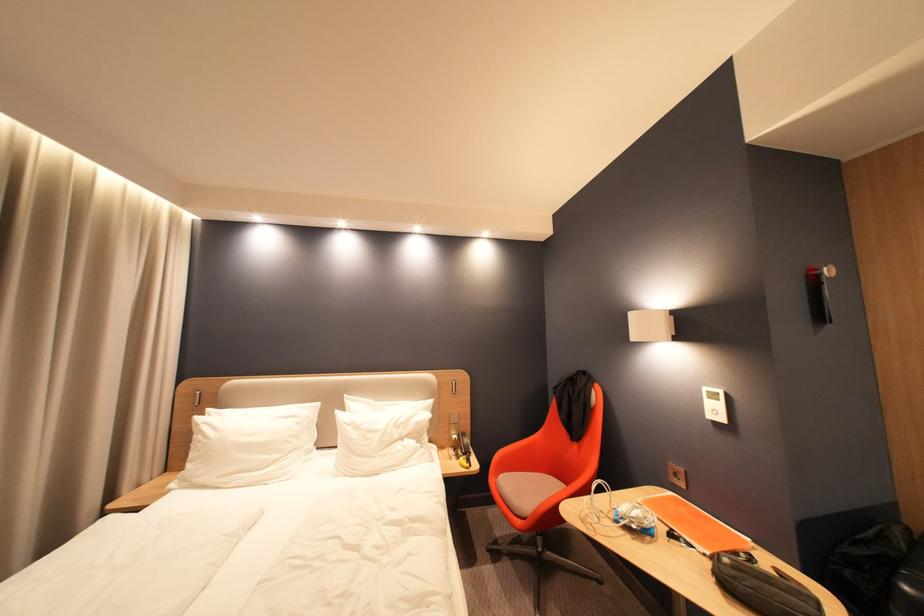
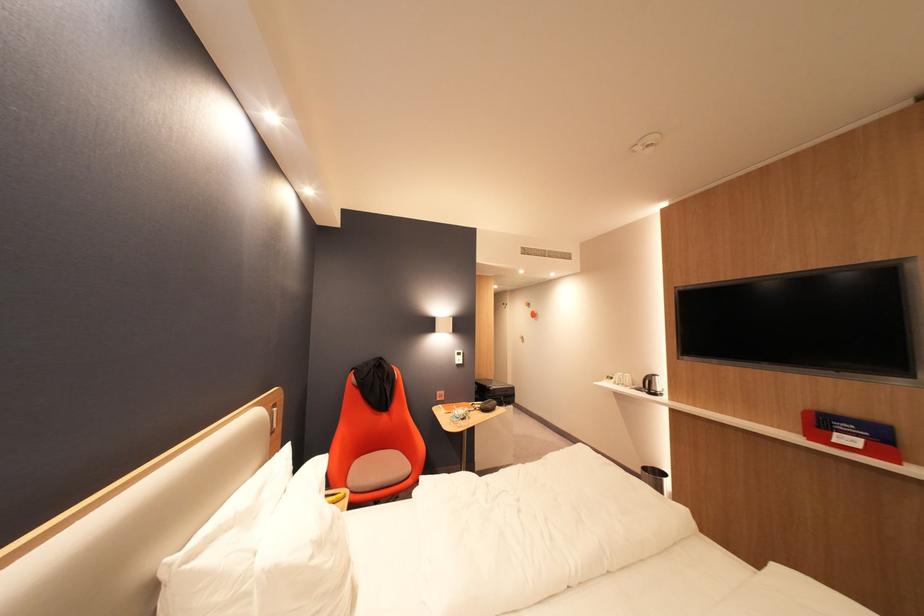
The point at (367, 428) is marked in the first image. Where is the corresponding point in the second image?

(330, 545)